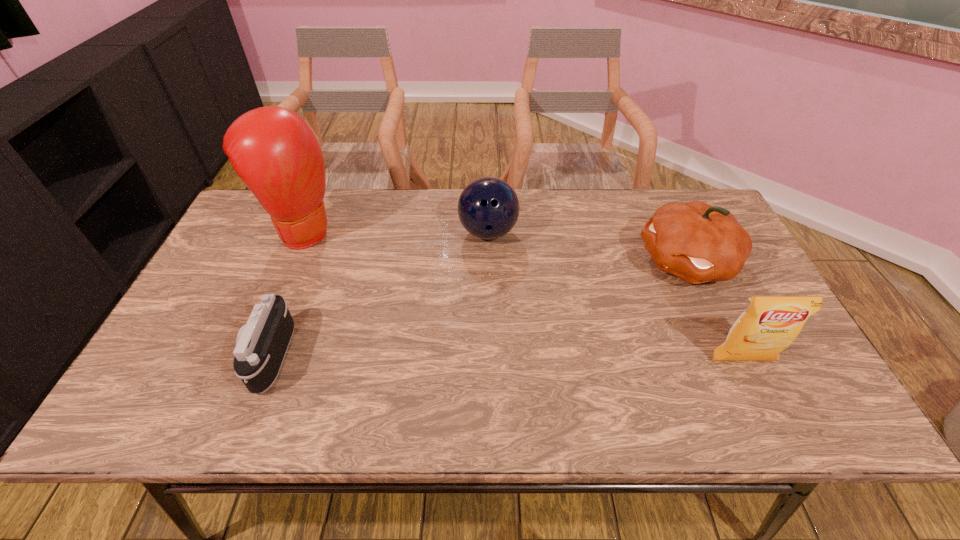
Find the location of `vacant space on the desktop that is between the shortest object and the crisp (potato chip) and is positioned on the front face of the pumpkin`. vacant space on the desktop that is between the shortest object and the crisp (potato chip) and is positioned on the front face of the pumpkin is located at coordinates (484, 358).

The width and height of the screenshot is (960, 540). What are the coordinates of `free space on the desktop that is between the shortest object and the crisp (potato chip) and is positioned on the striking surface of the tallest object` in the screenshot? It's located at (468, 358).

Where is `free space on the desktop that is between the camera and the crisp (potato chip) and is positioned on the surface of the second shortest object near the finger holes`? The image size is (960, 540). free space on the desktop that is between the camera and the crisp (potato chip) and is positioned on the surface of the second shortest object near the finger holes is located at coordinates (554, 359).